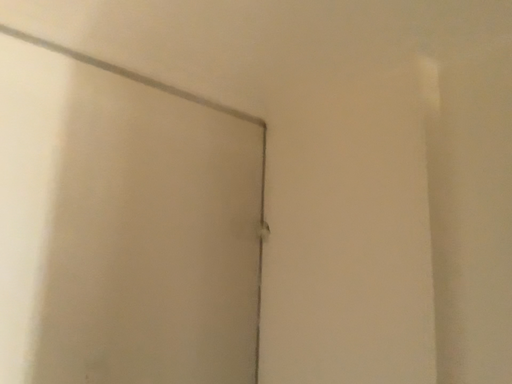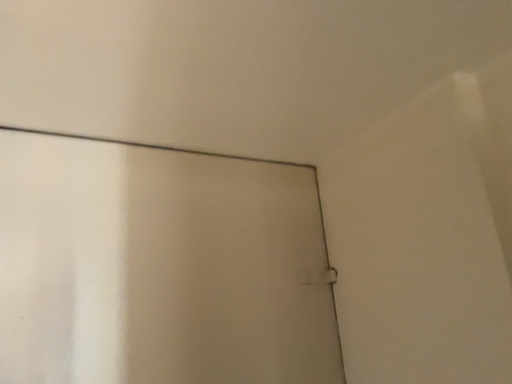
Question: Which way did the camera rotate in the video?

Choices:
 (A) rotated right
 (B) rotated left

Answer: (B)